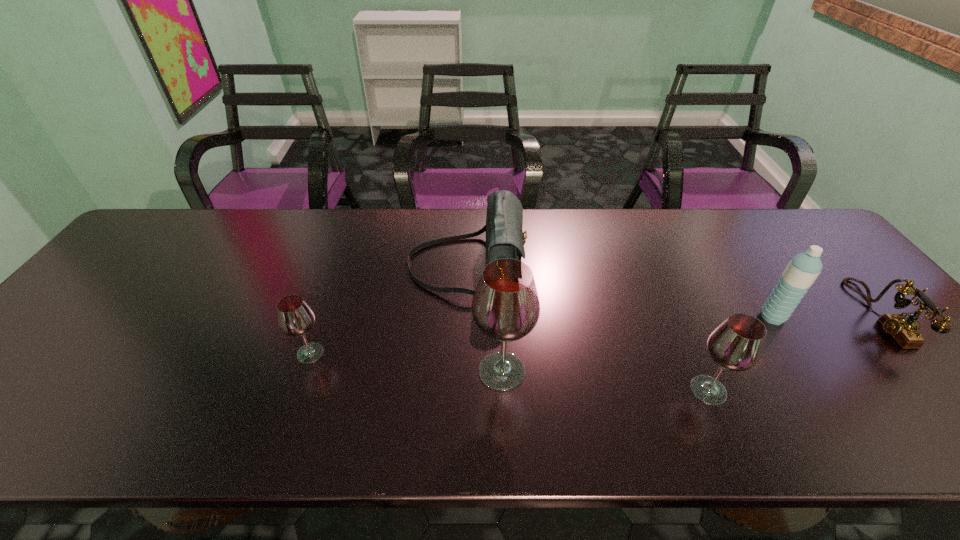
This screenshot has width=960, height=540. Identify the location of empty space between the tallest wineglass and the water bottle. (637, 344).

Locate an element on the screen. The image size is (960, 540). vacant area that lies between the second wineglass from left to right and the fourth object from left to right is located at coordinates (606, 381).

You are a GUI agent. You are given a task and a screenshot of the screen. Output one action in this format:
    pyautogui.click(x=<x>, y=<y>)
    Task: Click on the unoccupied area between the water bottle and the second shortest object
    This screenshot has width=960, height=540.
    Given the screenshot: What is the action you would take?
    pyautogui.click(x=541, y=335)

Image resolution: width=960 pixels, height=540 pixels. I want to click on the fifth closest object to the shoulder bag, so click(x=904, y=330).

The height and width of the screenshot is (540, 960). What are the coordinates of `object that can be found as the third closest to the third object from right to left` in the screenshot? It's located at (505, 238).

Select which wineglass appears as the third closest to the shoulder bag. Please provide its 2D coordinates. Your answer should be formatted as a tuple, i.e. [(x, y)], where the tuple contains the x and y coordinates of a point satisfying the conditions above.

[(737, 344)]

Locate which wineglass ranks second in proximity to the third object from right to left. Please provide its 2D coordinates. Your answer should be formatted as a tuple, i.e. [(x, y)], where the tuple contains the x and y coordinates of a point satisfying the conditions above.

[(295, 318)]

I want to click on vacant area that satisfies the following two spatial constraints: 1. on the front-facing side of the shortest object; 2. on the front side of the leftmost object, so click(x=912, y=353).

This screenshot has height=540, width=960. In order to click on free location that satisfies the following two spatial constraints: 1. on the front side of the tallest wineglass; 2. on the right side of the shortest wineglass in this screenshot , I will do `click(304, 371)`.

Identify the location of free space that satisfies the following two spatial constraints: 1. on the back side of the water bottle; 2. on the left side of the shortest wineglass. The width and height of the screenshot is (960, 540). (323, 317).